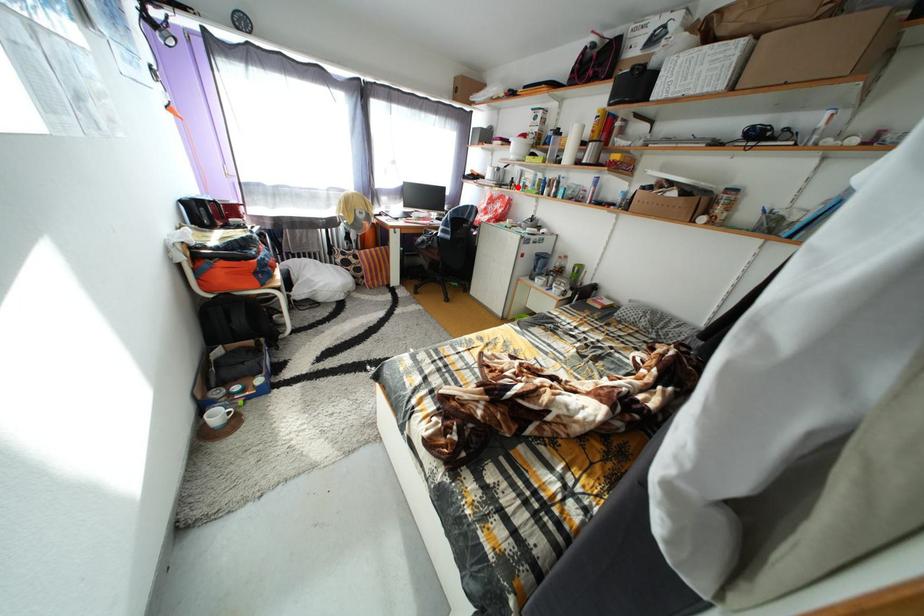
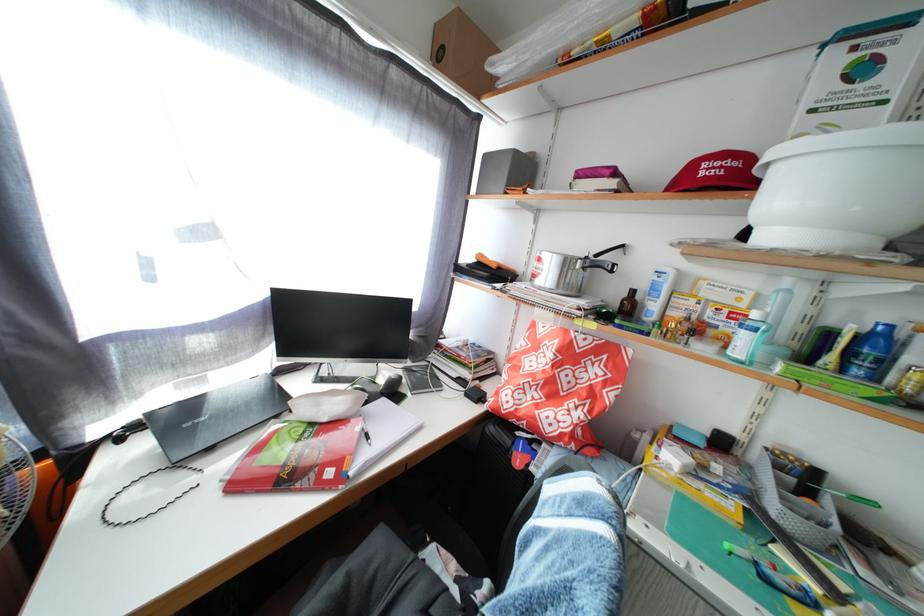
Find the pixel in the second image that matches the highlighted location in the first image.

(621, 301)